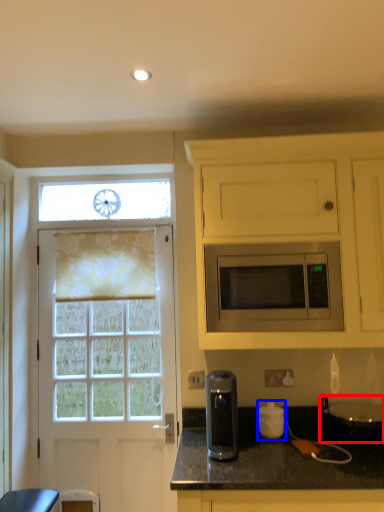
Question: Among these objects, which one is farthest to the camera, appliance (highlighted by a red box) or appliance (highlighted by a blue box)?

Choices:
 (A) appliance
 (B) appliance

Answer: (B)